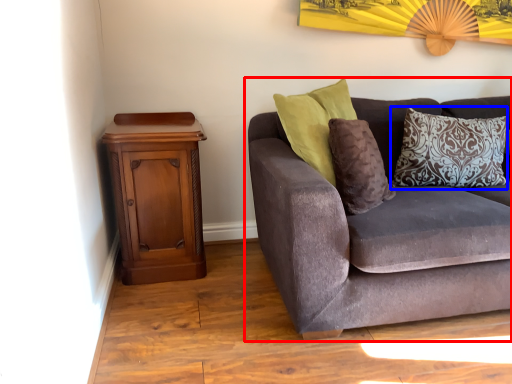
Question: Which of the following is the farthest to the observer, studio couch (highlighted by a red box) or pillow (highlighted by a blue box)?

Choices:
 (A) studio couch
 (B) pillow

Answer: (B)